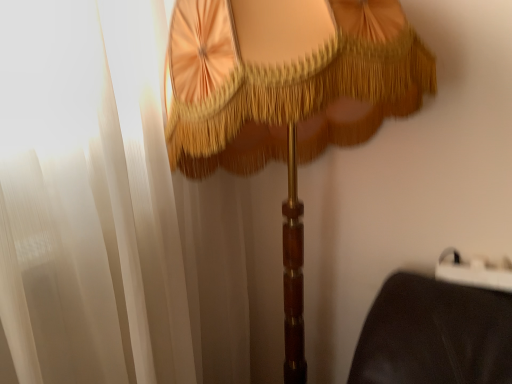
Question: Should I look upward or downward to see matte gold fabric umbrella at center?

Choices:
 (A) down
 (B) up

Answer: (A)